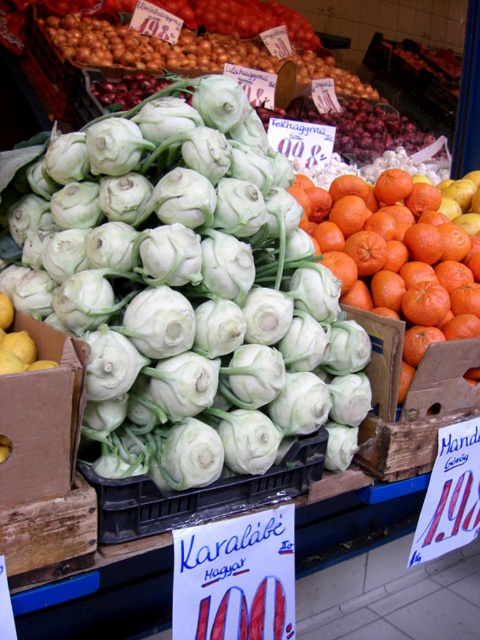
You are a photographer standing at the market stall. You want to take a closeup photo of the white matte kohlrabi at center. Currently, you are 3 feet away from it. Do you need to move closer or farther away to get a better closeup?

The white matte kohlrabi at center is 33.43 inches away from camera. Since 33.43 inches is approximately 2.78 feet, you are currently 3 feet away, which is slightly farther than the optimal distance. To get a better closeup, you should move closer to the white matte kohlrabi at center until you are about 2.78 feet away.

You are a customer at the market stall and want to find the white matte kohlrabi at center. Based on the coordinates provided, can you determine its exact position relative to the other items?

The white matte kohlrabi at center is located at point coordinates (184,289), which places it centrally in the image, making it easily accessible from the front of the stall.